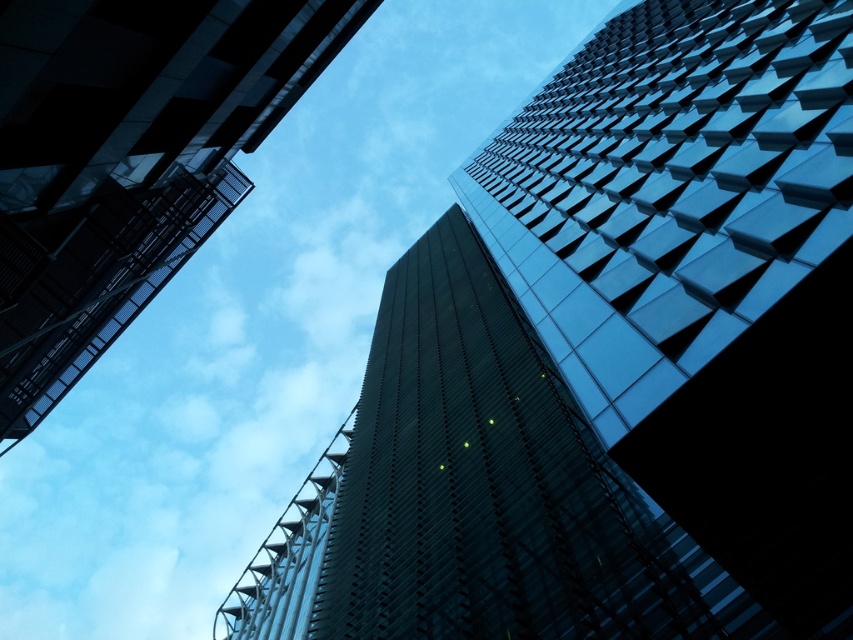
Question: Which object appears closest to the camera in this image?

Choices:
 (A) glassy reflective skyscraper at upper left
 (B) glassy reflective skyscraper at center

Answer: (A)

Question: Is glassy reflective skyscraper at center wider than glassy reflective skyscraper at upper left?

Choices:
 (A) yes
 (B) no

Answer: (A)

Question: Is glassy reflective skyscraper at center to the right of glassy reflective skyscraper at upper left from the viewer's perspective?

Choices:
 (A) no
 (B) yes

Answer: (B)

Question: Is glassy reflective skyscraper at center further to the viewer compared to glassy reflective skyscraper at upper left?

Choices:
 (A) no
 (B) yes

Answer: (B)

Question: Which of the following is the closest to the observer?

Choices:
 (A) glassy reflective skyscraper at center
 (B) glassy reflective skyscraper at upper left

Answer: (B)

Question: Which point appears closest to the camera in this image?

Choices:
 (A) (762, 579)
 (B) (108, 134)

Answer: (A)